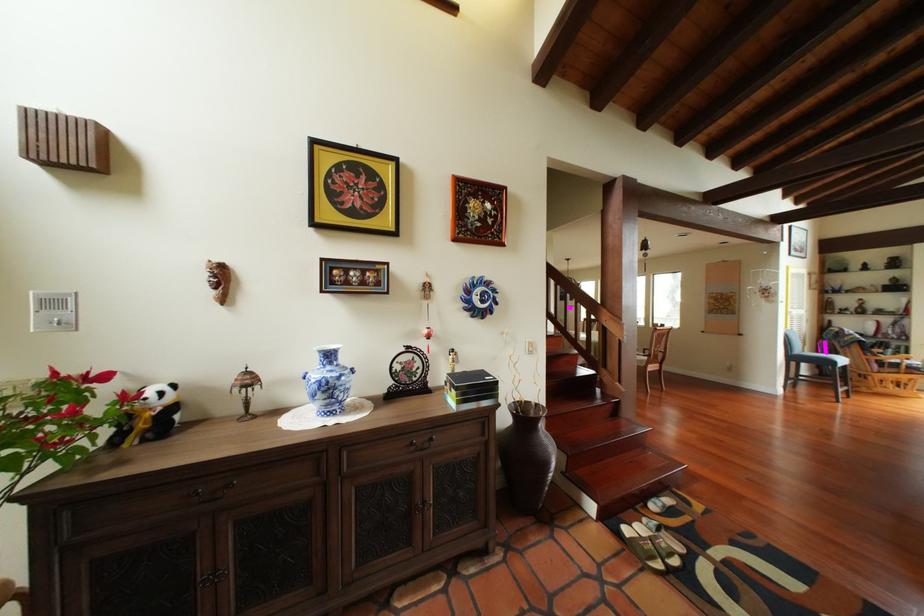
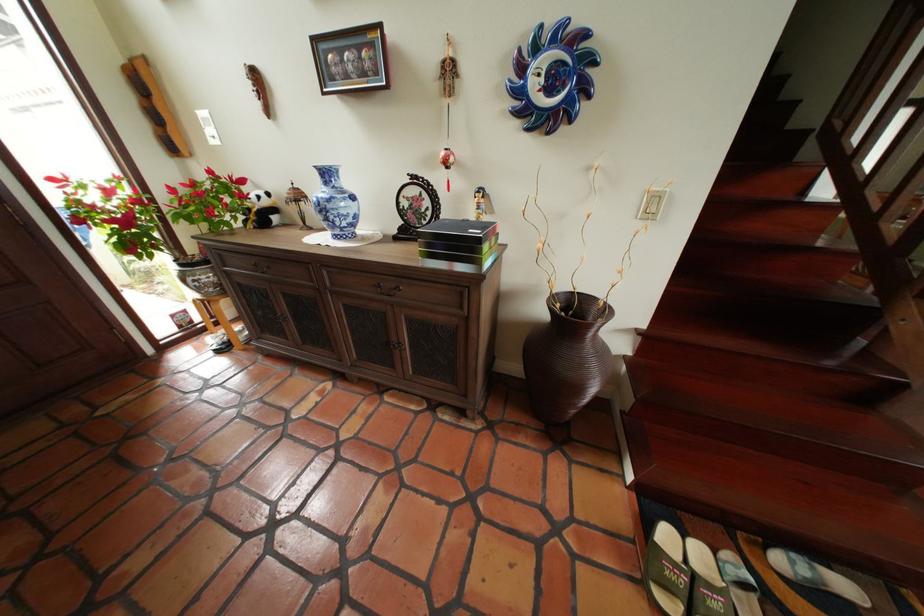
Locate, in the second image, the point that corresponds to pixel 347 391 in the first image.

(341, 214)